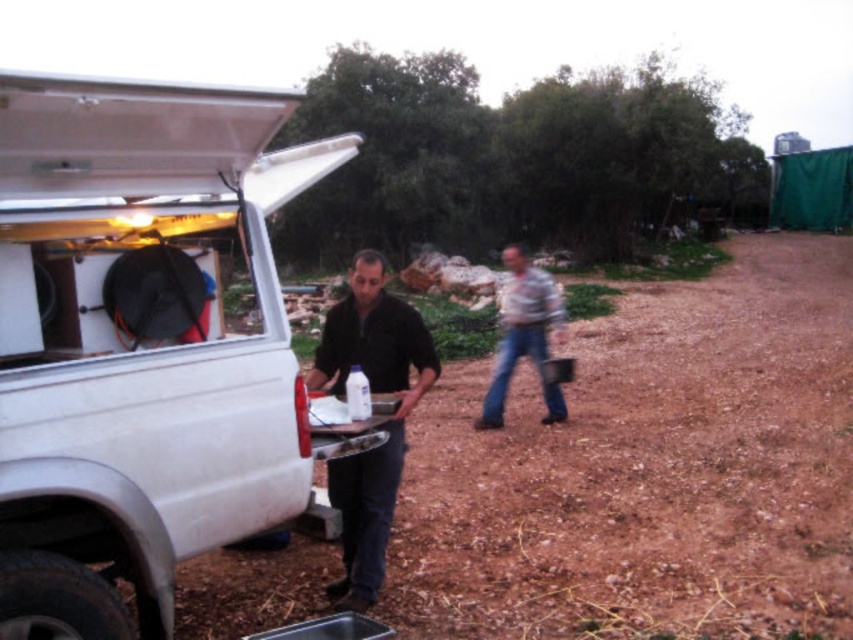
You are a delivery person who needs to park your truck on the brown dirt field at center. However, there is already a white matte van at center parked there. Based on the scene, can you park your truck in the same spot as the van?

The brown dirt field at center is positioned under the white matte van at center, meaning the van is already occupying that space. Therefore, you cannot park your truck in the same spot as the van.

You are standing in the outdoor scene and want to move from the white matte van at center to the black matte shirt at center. Which direction should you move in?

You should move to the right to go from the white matte van at center to the black matte shirt at center because the white matte van at center is to the left of the black matte shirt at center.